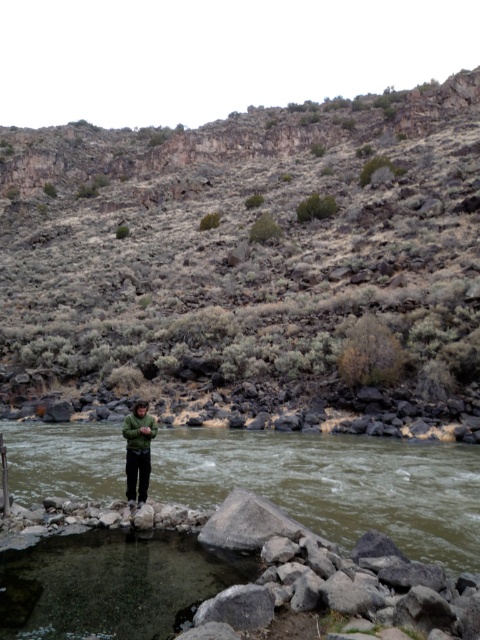
Is green fabric river at center to the right of green matte jacket at center from the viewer's perspective?

Correct, you'll find green fabric river at center to the right of green matte jacket at center.

Between point (478, 561) and point (132, 456), which one is positioned behind?

Point (132, 456)

Between point (157, 465) and point (134, 458), which one is positioned in front?

Point (134, 458) is more forward.

Identify the location of green fabric river at center. This screenshot has width=480, height=640. (335, 484).

Is brown rocky hillside at upper center bigger than green matte jacket at center?

Yes, brown rocky hillside at upper center is bigger than green matte jacket at center.

Between brown rocky hillside at upper center and green matte jacket at center, which one is positioned higher?

brown rocky hillside at upper center is higher up.

Where is `brown rocky hillside at upper center`? The image size is (480, 640). brown rocky hillside at upper center is located at coordinates (251, 268).

Is brown rocky hillside at upper center below green fabric river at center?

Actually, brown rocky hillside at upper center is above green fabric river at center.

Does brown rocky hillside at upper center have a smaller size compared to green fabric river at center?

No.

At what (x,y) coordinates should I click in order to perform the action: click on brown rocky hillside at upper center. Please return your answer as a coordinate pair (x, y). The image size is (480, 640). Looking at the image, I should click on (251, 268).

This screenshot has height=640, width=480. Find the location of `brown rocky hillside at upper center`. brown rocky hillside at upper center is located at coordinates (251, 268).